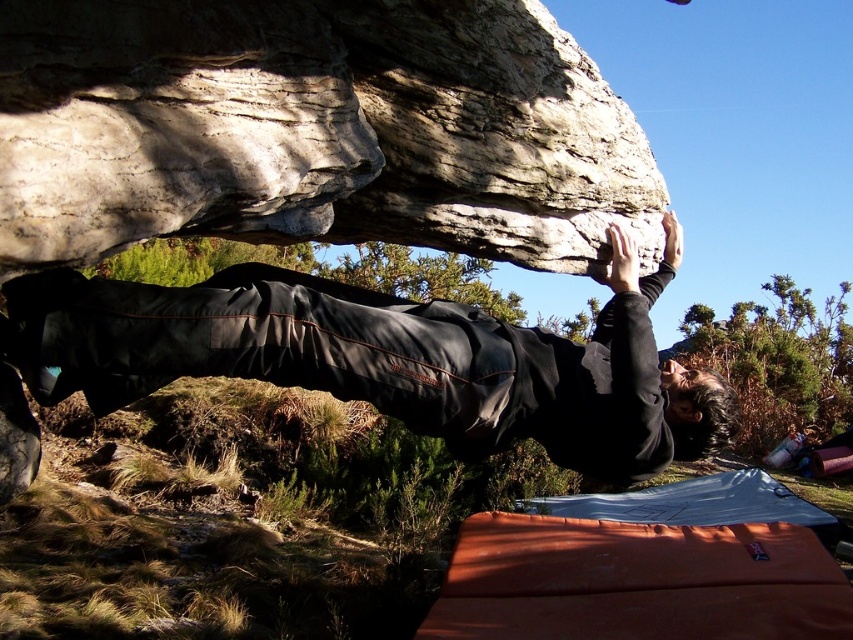
Can you confirm if rough textured rock at upper center is positioned to the right of black matte pants at center?

No, rough textured rock at upper center is not to the right of black matte pants at center.

Does rough textured rock at upper center lie behind black matte pants at center?

No, it is in front of black matte pants at center.

Who is more distant from viewer, (383, 189) or (490, 356)?

Point (383, 189)

Locate an element on the screen. rough textured rock at upper center is located at coordinates (312, 129).